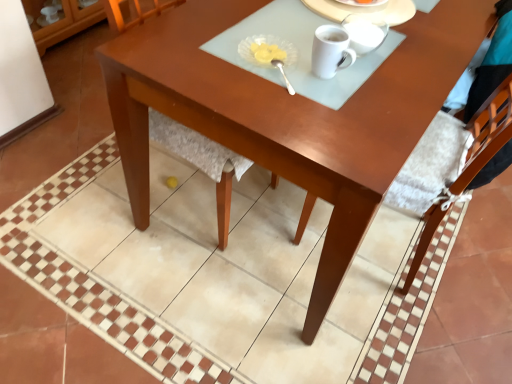
What are the coordinates of `free area in between white glossy mug at upper center and silver metallic spoon at center, the first tableware when ordered from bottom to top` in the screenshot? It's located at 304,76.